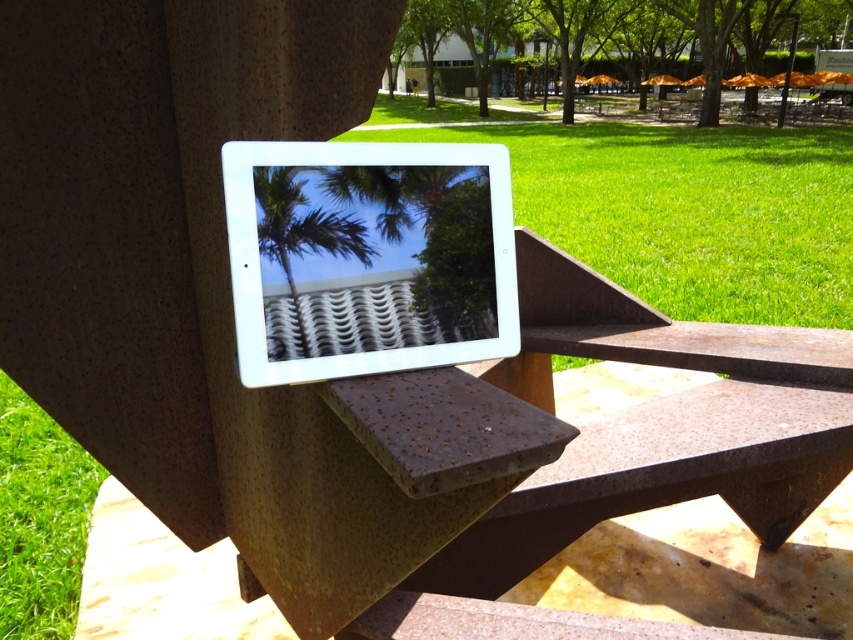
Can you confirm if green grass at center is shorter than green leafy tree at upper center?

In fact, green grass at center may be taller than green leafy tree at upper center.

Who is taller, green grass at center or green leafy tree at upper center?

With more height is green grass at center.

Who is more distant from viewer, (595, 200) or (553, 42)?

Point (553, 42)

The image size is (853, 640). Find the location of `green grass at center`. green grass at center is located at coordinates (688, 211).

Can you confirm if green grass at lower left is positioned above green leafy tree at upper center?

No.

Who is higher up, green grass at lower left or green leafy tree at upper center?

Positioned higher is green leafy tree at upper center.

Describe the element at coordinates (39, 518) in the screenshot. This screenshot has width=853, height=640. I see `green grass at lower left` at that location.

Locate an element on the screen. Image resolution: width=853 pixels, height=640 pixels. green grass at lower left is located at coordinates (39, 518).

Does point (701, 113) come behind point (312, 209)?

Yes, it is behind point (312, 209).

Does green leafy tree at upper center have a lesser width compared to green leafy palm tree at upper center?

No.

Who is more forward, (560,48) or (318,243)?

Point (318,243)

Where is `green leafy tree at upper center`? The width and height of the screenshot is (853, 640). green leafy tree at upper center is located at coordinates (724, 54).